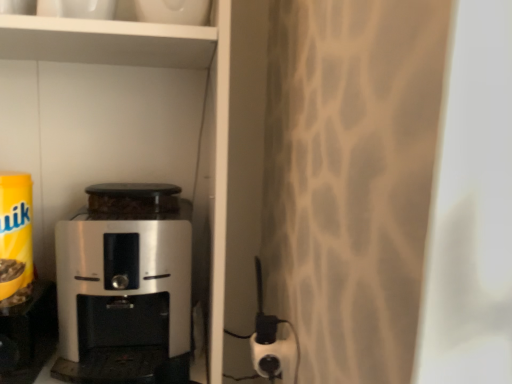
What do you see at coordinates (125, 287) in the screenshot? I see `satin silver coffee maker at lower left` at bounding box center [125, 287].

Find the location of a particular element. satin silver coffee maker at lower left is located at coordinates (125, 287).

This screenshot has width=512, height=384. Identify the location of satin silver coffee maker at lower left. (125, 287).